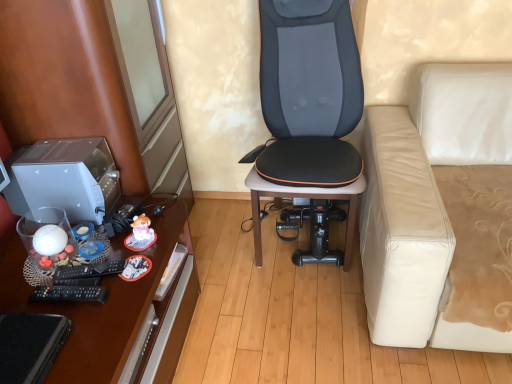
Question: Is satin silver desktop at left facing towards black leather chair at center?

Choices:
 (A) yes
 (B) no

Answer: (B)

Question: Does satin silver desktop at left have a larger size compared to black leather chair at center?

Choices:
 (A) yes
 (B) no

Answer: (B)

Question: Would you consider satin silver desktop at left to be distant from black leather chair at center?

Choices:
 (A) yes
 (B) no

Answer: (B)

Question: Is satin silver desktop at left thinner than black leather chair at center?

Choices:
 (A) yes
 (B) no

Answer: (A)

Question: From the image's perspective, would you say satin silver desktop at left is positioned over black leather chair at center?

Choices:
 (A) yes
 (B) no

Answer: (B)

Question: Can you confirm if satin silver desktop at left is taller than black leather chair at center?

Choices:
 (A) yes
 (B) no

Answer: (B)

Question: Can you confirm if satin silver desktop at left is thinner than brown wood dresser at left?

Choices:
 (A) yes
 (B) no

Answer: (A)

Question: From the image's perspective, does satin silver desktop at left appear lower than brown wood dresser at left?

Choices:
 (A) yes
 (B) no

Answer: (A)

Question: Can you confirm if satin silver desktop at left is positioned to the right of brown wood dresser at left?

Choices:
 (A) no
 (B) yes

Answer: (A)

Question: Is brown wood dresser at left inside satin silver desktop at left?

Choices:
 (A) yes
 (B) no

Answer: (B)

Question: Does satin silver desktop at left turn towards brown wood dresser at left?

Choices:
 (A) no
 (B) yes

Answer: (A)

Question: Is satin silver desktop at left turned away from brown wood dresser at left?

Choices:
 (A) no
 (B) yes

Answer: (A)

Question: Is black leather chair at center facing towards brown wooden desk at left?

Choices:
 (A) yes
 (B) no

Answer: (B)